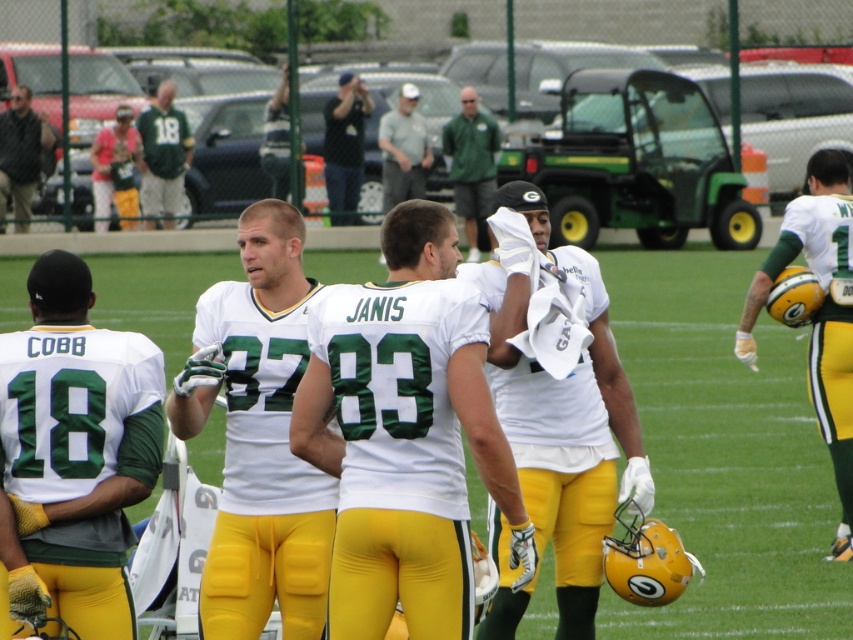
Question: Is green jersey at center in front of dark gray fabric camera at upper center?

Choices:
 (A) yes
 (B) no

Answer: (A)

Question: Which point is closer to the camera?

Choices:
 (A) matte black jacket at left
 (B) matte green jersey at center
 (C) matte green jersey at upper left

Answer: (B)

Question: Which of these objects is positioned closest to the yellow-green jersey at center?

Choices:
 (A) gray cotton shirt at center
 (B) white jersey at center
 (C) dark gray fabric camera at upper center

Answer: (B)

Question: Based on their relative distances, which object is nearer to the green jersey at center?

Choices:
 (A) white matte helmet at center
 (B) matte green jersey at center

Answer: (A)

Question: Where is dark gray fabric camera at upper center located in relation to gray cotton shirt at center in the image?

Choices:
 (A) below
 (B) above

Answer: (A)

Question: Is yellow-green jersey at center above green jersey at center?

Choices:
 (A) no
 (B) yes

Answer: (A)